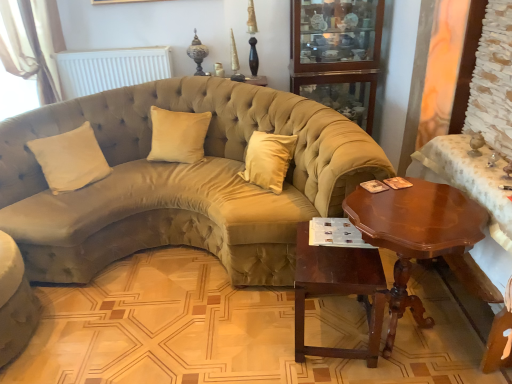
Find the location of a particular element. Image resolution: width=512 pixels, height=384 pixels. vacant region to the left of mahogany wood table at lower center is located at coordinates (252, 331).